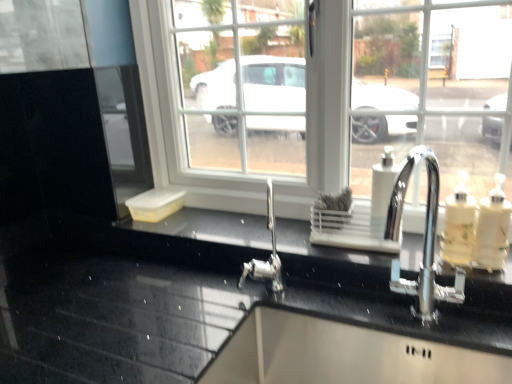
Question: Is white glossy soap dispenser at right, acting as the 1th soap dispenser starting from the right, positioned beyond the bounds of translucent plastic soap dispenser at right, positioned as the 2th soap dispenser in left-to-right order?

Choices:
 (A) yes
 (B) no

Answer: (A)

Question: Considering the relative sizes of white glossy soap dispenser at right, acting as the 1th soap dispenser starting from the right, and translucent plastic soap dispenser at right, positioned as the 2th soap dispenser in left-to-right order, in the image provided, is white glossy soap dispenser at right, acting as the 1th soap dispenser starting from the right, smaller than translucent plastic soap dispenser at right, positioned as the 2th soap dispenser in left-to-right order,?

Choices:
 (A) yes
 (B) no

Answer: (A)

Question: Is white glossy soap dispenser at right, positioned as the 3th soap dispenser in left-to-right order, to the right of translucent plastic soap dispenser at right, positioned as the 2th soap dispenser in right-to-left order, from the viewer's perspective?

Choices:
 (A) yes
 (B) no

Answer: (A)

Question: Is white glossy soap dispenser at right, acting as the 1th soap dispenser starting from the right, positioned in front of translucent plastic soap dispenser at right, positioned as the 2th soap dispenser in left-to-right order?

Choices:
 (A) yes
 (B) no

Answer: (A)

Question: From a real-world perspective, is white glossy soap dispenser at right, positioned as the 3th soap dispenser in left-to-right order, physically above translucent plastic soap dispenser at right, positioned as the 2th soap dispenser in right-to-left order?

Choices:
 (A) no
 (B) yes

Answer: (B)

Question: Is white glossy soap dispenser at right, positioned as the 3th soap dispenser in left-to-right order, oriented towards translucent plastic soap dispenser at right, positioned as the 2th soap dispenser in left-to-right order?

Choices:
 (A) no
 (B) yes

Answer: (A)

Question: Are white plastic soap dispenser at center-right, marked as the third soap dispenser in a right-to-left arrangement, and white glossy soap dispenser at right, positioned as the 3th soap dispenser in left-to-right order, beside each other?

Choices:
 (A) yes
 (B) no

Answer: (B)

Question: Does white plastic soap dispenser at center-right, marked as the third soap dispenser in a right-to-left arrangement, have a lesser width compared to white glossy soap dispenser at right, acting as the 1th soap dispenser starting from the right?

Choices:
 (A) no
 (B) yes

Answer: (B)

Question: Can you confirm if white plastic soap dispenser at center-right, marked as the third soap dispenser in a right-to-left arrangement, is bigger than white glossy soap dispenser at right, positioned as the 3th soap dispenser in left-to-right order?

Choices:
 (A) yes
 (B) no

Answer: (B)

Question: From a real-world perspective, is white plastic soap dispenser at center-right, marked as the third soap dispenser in a right-to-left arrangement, positioned over white glossy soap dispenser at right, positioned as the 3th soap dispenser in left-to-right order, based on gravity?

Choices:
 (A) no
 (B) yes

Answer: (B)

Question: Can you confirm if white plastic soap dispenser at center-right, marked as the third soap dispenser in a right-to-left arrangement, is taller than white glossy soap dispenser at right, acting as the 1th soap dispenser starting from the right?

Choices:
 (A) yes
 (B) no

Answer: (A)

Question: Can you confirm if white plastic soap dispenser at center-right, arranged as the 1th soap dispenser when viewed from the left, is wider than white glossy soap dispenser at right, positioned as the 3th soap dispenser in left-to-right order?

Choices:
 (A) no
 (B) yes

Answer: (A)

Question: Is translucent plastic soap dispenser at right, positioned as the 2th soap dispenser in left-to-right order, positioned far away from white plastic soap dispenser at center-right, marked as the third soap dispenser in a right-to-left arrangement?

Choices:
 (A) no
 (B) yes

Answer: (A)